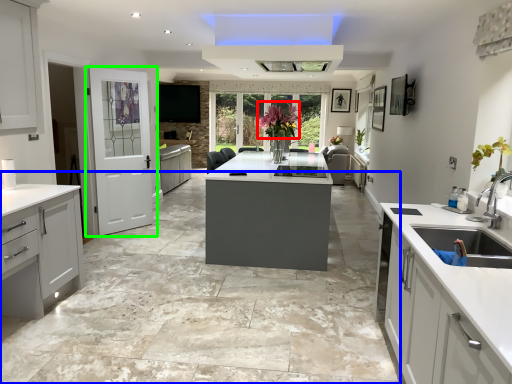
Question: Estimate the real-world distances between objects in this image. Which object is farther from floral arrangement (highlighted by a red box), concrete (highlighted by a blue box) or door (highlighted by a green box)?

Choices:
 (A) concrete
 (B) door

Answer: (A)